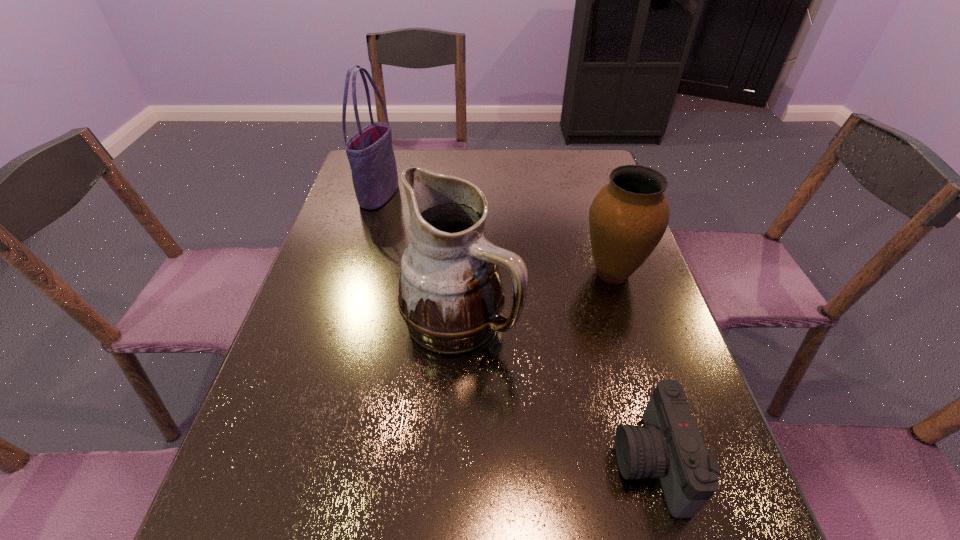
Find the location of a particular element. the leftmost object is located at coordinates (370, 152).

Identify the location of tote bag. This screenshot has width=960, height=540. (370, 152).

At what (x,y) coordinates should I click in order to perform the action: click on the third object from right to left. Please return your answer as a coordinate pair (x, y). The image size is (960, 540). Looking at the image, I should click on (451, 296).

Find the location of a particular element. The width and height of the screenshot is (960, 540). urn is located at coordinates (628, 217).

What are the coordinates of `the shortest object` in the screenshot? It's located at (669, 446).

You are a GUI agent. You are given a task and a screenshot of the screen. Output one action in this format:
    pyautogui.click(x=<x>, y=<y>)
    Task: Click on the camera
    The width and height of the screenshot is (960, 540).
    Given the screenshot: What is the action you would take?
    pyautogui.click(x=669, y=446)

Find the location of a particular element. vacant point located 0.160m on the front of the leftmost object is located at coordinates (365, 247).

This screenshot has width=960, height=540. In order to click on vacant space located from the spout of the pitcher in this screenshot , I will do `click(670, 320)`.

Find the location of `vacant space situated 0.220m on the left of the urn`. vacant space situated 0.220m on the left of the urn is located at coordinates coord(492,273).

Identify the location of vacant space situated at the lens of the shortest object. This screenshot has height=540, width=960. (520, 462).